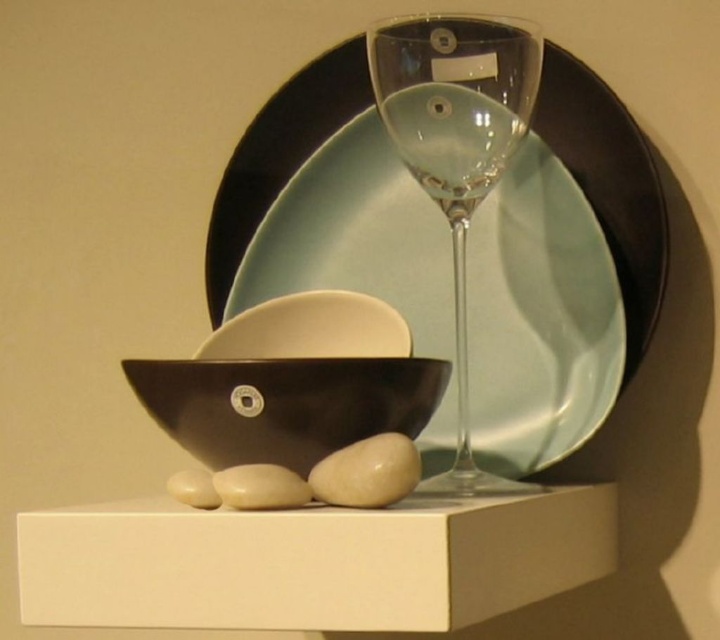
Is light blue glossy plate at center shorter than white smooth stone at center?

No, light blue glossy plate at center is not shorter than white smooth stone at center.

Which is in front, point (495, 256) or point (243, 497)?

Point (243, 497) is in front.

Does point (348, 154) come in front of point (224, 483)?

No, (348, 154) is behind (224, 483).

Identify the location of light blue glossy plate at center. The image size is (720, 640). (540, 317).

In the scene shown: Is light blue glossy plate at center bigger than transparent glass wine glass at upper center?

Indeed, light blue glossy plate at center has a larger size compared to transparent glass wine glass at upper center.

Can you confirm if light blue glossy plate at center is wider than transparent glass wine glass at upper center?

Yes.

Does point (508, 369) lie behind point (402, 124)?

Yes, point (508, 369) is behind point (402, 124).

This screenshot has height=640, width=720. I want to click on light blue glossy plate at center, so click(540, 317).

Measure the distance between transparent glass wine glass at center and white smooth stone at lower center.

The distance of transparent glass wine glass at center from white smooth stone at lower center is 8.19 inches.

Is transparent glass wine glass at center taller than white smooth stone at lower center?

Yes, transparent glass wine glass at center is taller than white smooth stone at lower center.

Between point (415, 134) and point (194, 506), which one is positioned in front?

Point (194, 506) is more forward.

Where is `transparent glass wine glass at center`? transparent glass wine glass at center is located at coordinates (456, 150).